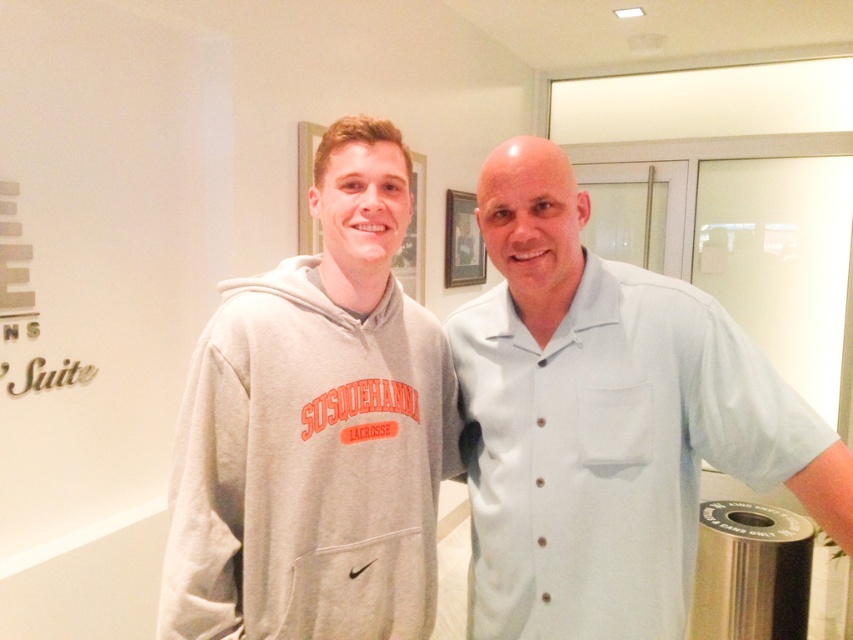
Can you confirm if light blue button-up shirt at right is positioned above gray fleece hoodie at center?

No.

Is point (579, 198) farther from viewer compared to point (416, 321)?

No, (579, 198) is in front of (416, 321).

Between point (672, 634) and point (270, 404), which one is positioned in front?

Point (270, 404)

I want to click on light blue button-up shirt at right, so click(x=606, y=420).